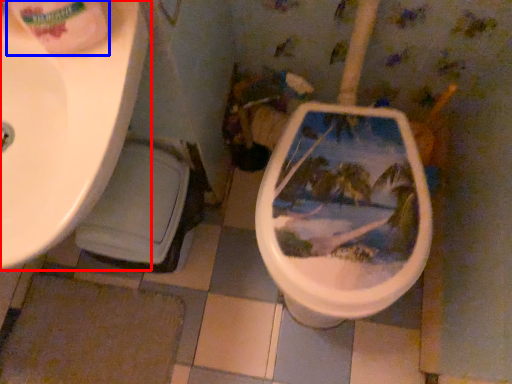
Question: Which of the following is the farthest to the observer, sink (highlighted by a red box) or toilet paper (highlighted by a blue box)?

Choices:
 (A) sink
 (B) toilet paper

Answer: (A)